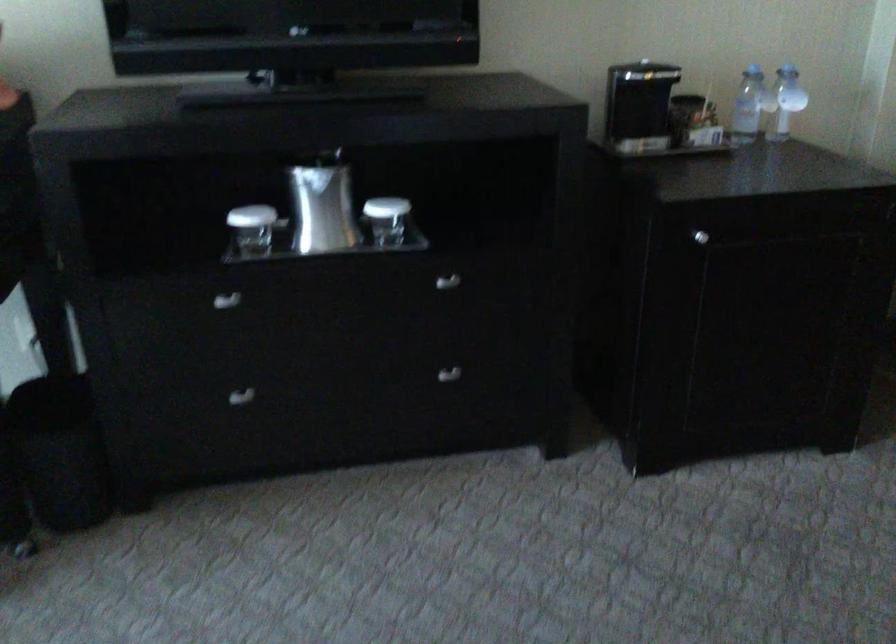
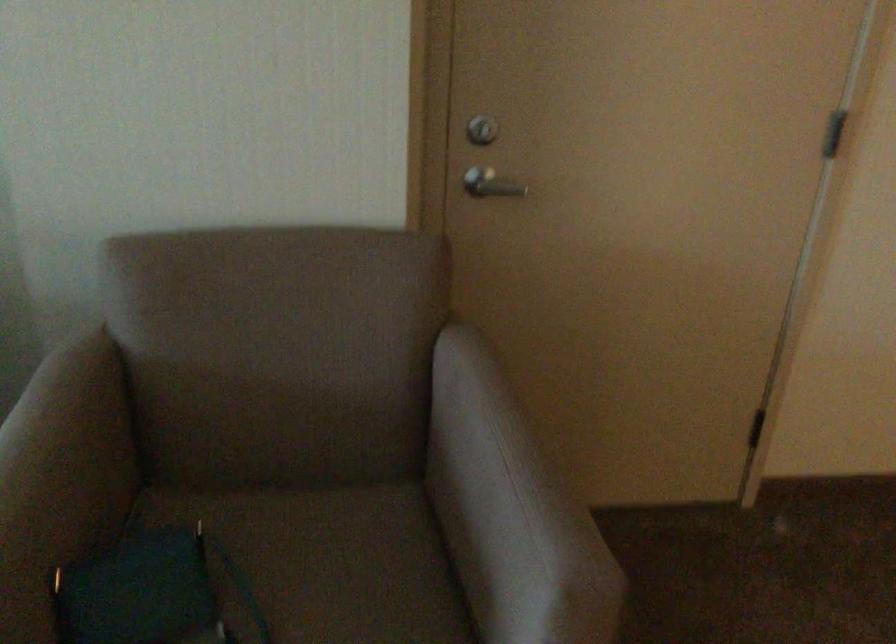
Which direction would the cameraman need to move to produce the second image?

The movement direction of the cameraman is right, forward.